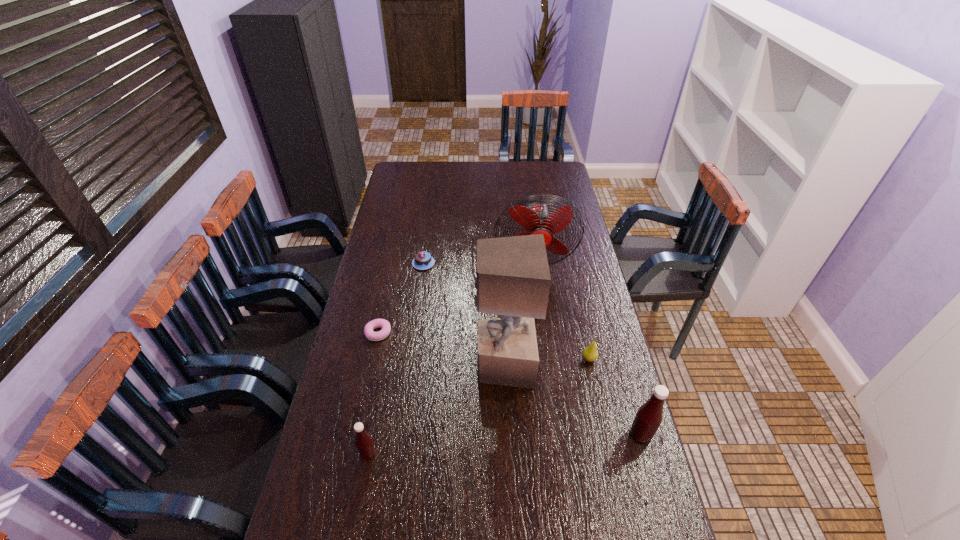
Where is `vacant region located 0.200m on the back of the nearest object`? vacant region located 0.200m on the back of the nearest object is located at coordinates (381, 385).

You are a GUI agent. You are given a task and a screenshot of the screen. Output one action in this format:
    pyautogui.click(x=<x>, y=<y>)
    Task: Click on the vacant space situated on the back of the third tallest object
    The height and width of the screenshot is (540, 960).
    Given the screenshot: What is the action you would take?
    pyautogui.click(x=609, y=321)

Locate an element on the screen. free space located on the front-facing side of the sixth shortest object is located at coordinates (539, 308).

At what (x,y) coordinates should I click in order to perform the action: click on vacant space situated 0.390m on the right of the sixth tallest object. Please return your answer as a coordinate pair (x, y). Looking at the image, I should click on tap(530, 263).

Where is `free space located 0.260m on the back of the pastry`? free space located 0.260m on the back of the pastry is located at coordinates (392, 274).

Image resolution: width=960 pixels, height=540 pixels. Identify the location of free space located on the front-facing side of the tallest object. (420, 364).

This screenshot has height=540, width=960. In order to click on free region located on the front-facing side of the tallest object in this screenshot , I will do `click(355, 364)`.

Identify the location of free space located 0.250m on the front-facing side of the tallest object. The width and height of the screenshot is (960, 540). (398, 364).

The width and height of the screenshot is (960, 540). What are the coordinates of `vacant space located 0.270m on the left of the pear` in the screenshot? It's located at click(499, 360).

Find the location of `Tabasco sauce that is at the left edge`. Tabasco sauce that is at the left edge is located at coordinates (364, 443).